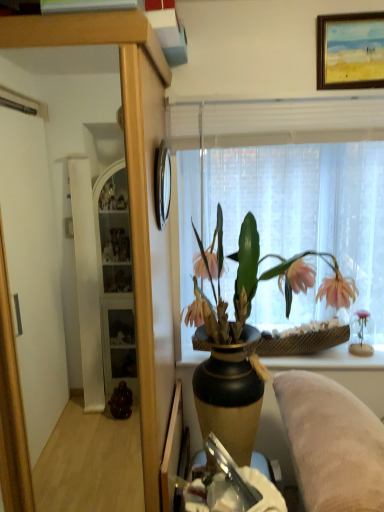
Question: From the image's perspective, is woven brown basket at right below translucent fabric at upper center?

Choices:
 (A) yes
 (B) no

Answer: (A)

Question: Does woven brown basket at right lie behind translucent fabric at upper center?

Choices:
 (A) yes
 (B) no

Answer: (A)

Question: Is the depth of woven brown basket at right less than that of translucent fabric at upper center?

Choices:
 (A) no
 (B) yes

Answer: (A)

Question: Is woven brown basket at right located outside translucent fabric at upper center?

Choices:
 (A) no
 (B) yes

Answer: (B)

Question: Is woven brown basket at right oriented away from translucent fabric at upper center?

Choices:
 (A) yes
 (B) no

Answer: (B)

Question: From the image's perspective, relative to translucent fabric at upper center, is wooden clock at upper center, which is the 2th picture frame from top to bottom, above or below?

Choices:
 (A) above
 (B) below

Answer: (A)

Question: In terms of width, does wooden clock at upper center, which is counted as the 2th picture frame, starting from the right, look wider or thinner when compared to translucent fabric at upper center?

Choices:
 (A) thin
 (B) wide

Answer: (A)

Question: Is point (160, 162) closer or farther from the camera than point (296, 212)?

Choices:
 (A) closer
 (B) farther

Answer: (A)

Question: Is wooden clock at upper center, which is the 2th picture frame from top to bottom, spatially inside translucent fabric at upper center, or outside of it?

Choices:
 (A) outside
 (B) inside

Answer: (A)

Question: Considering the positions of wooden-framed painting at upper center, which is the first picture frame in right-to-left order, and matte black vase with pink flowers at center in the image, is wooden-framed painting at upper center, which is the first picture frame in right-to-left order, wider or thinner than matte black vase with pink flowers at center?

Choices:
 (A) thin
 (B) wide

Answer: (A)

Question: Looking at the image, does wooden-framed painting at upper center, the 2th picture frame viewed from the left, seem bigger or smaller compared to matte black vase with pink flowers at center?

Choices:
 (A) small
 (B) big

Answer: (A)

Question: Relative to matte black vase with pink flowers at center, is wooden-framed painting at upper center, the 2th picture frame viewed from the left, in front or behind?

Choices:
 (A) front
 (B) behind

Answer: (B)

Question: Is wooden-framed painting at upper center, the 2th picture frame viewed from the left, inside or outside of matte black vase with pink flowers at center?

Choices:
 (A) inside
 (B) outside

Answer: (B)

Question: Considering their positions, is woven brown basket at right located in front of or behind wooden-framed painting at upper center, the 2th picture frame viewed from the left?

Choices:
 (A) behind
 (B) front

Answer: (A)

Question: From a real-world perspective, is woven brown basket at right physically located above or below wooden-framed painting at upper center, the 2th picture frame viewed from the left?

Choices:
 (A) below
 (B) above

Answer: (A)